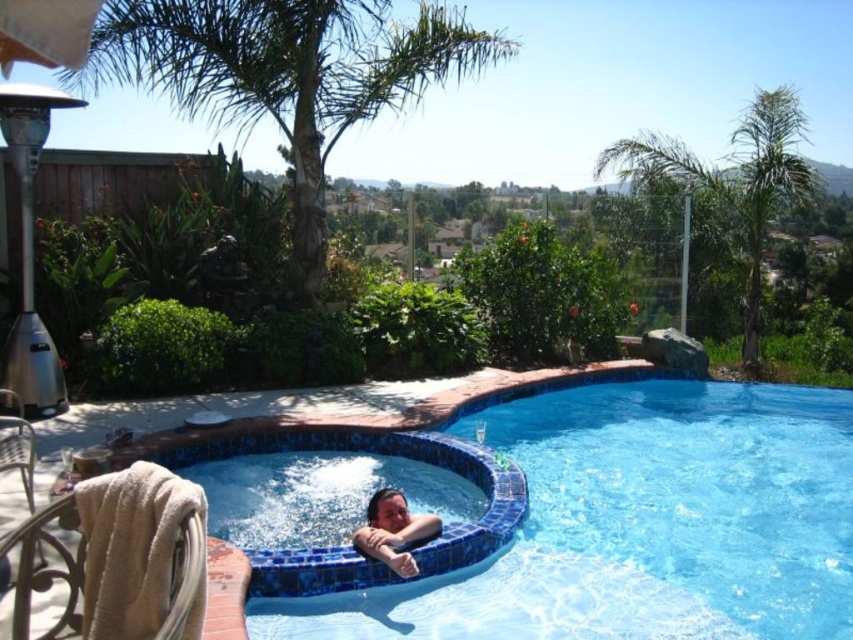
Question: From the image, what is the correct spatial relationship of blue mosaic tile swimming pool at center in relation to smooth skin child at lower center?

Choices:
 (A) right
 (B) left

Answer: (A)

Question: Which point is closer to the camera taking this photo?

Choices:
 (A) (357, 532)
 (B) (606, 532)

Answer: (A)

Question: Is blue mosaic tile swimming pool at center bigger than smooth skin child at lower center?

Choices:
 (A) yes
 (B) no

Answer: (B)

Question: Which object is closer to the camera taking this photo?

Choices:
 (A) blue mosaic tile swimming pool at center
 (B) smooth skin child at lower center

Answer: (B)

Question: Does blue mosaic tile swimming pool at center appear on the left side of smooth skin child at lower center?

Choices:
 (A) no
 (B) yes

Answer: (A)

Question: Which of the following is the closest to the observer?

Choices:
 (A) blue mosaic tile swimming pool at center
 (B) smooth skin child at lower center

Answer: (B)